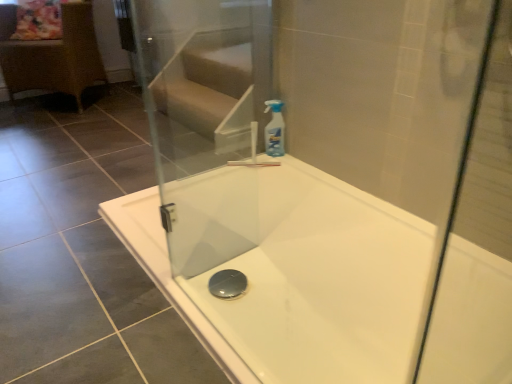
Question: In terms of height, does white glossy bathtub at center look taller or shorter compared to transparent glass screen door at upper center?

Choices:
 (A) short
 (B) tall

Answer: (A)

Question: Is white glossy bathtub at center in front of or behind transparent glass screen door at upper center in the image?

Choices:
 (A) behind
 (B) front

Answer: (B)

Question: Which object is the farthest from the rattan wicker chair at left?

Choices:
 (A) white glossy bathtub at center
 (B) transparent glass screen door at upper center
 (C) transparent plastic spray bottle at upper right

Answer: (A)

Question: Based on their relative distances, which object is farther from the rattan wicker chair at left?

Choices:
 (A) transparent glass screen door at upper center
 (B) white glossy bathtub at center
 (C) transparent plastic spray bottle at upper right

Answer: (B)